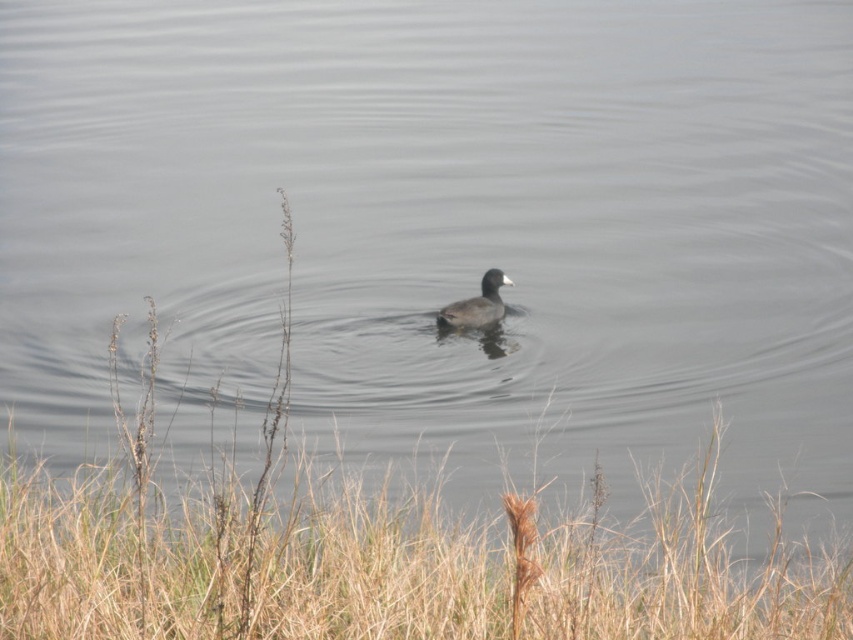
Which of these two, dry grass at lower center or dark brown feathers at center, stands taller?

dry grass at lower center is taller.

Between point (398, 595) and point (482, 307), which one is positioned in front?

Point (398, 595) is more forward.

Consider the image. Who is more forward, (x=228, y=468) or (x=461, y=316)?

Point (x=228, y=468)

I want to click on dry grass at lower center, so click(380, 557).